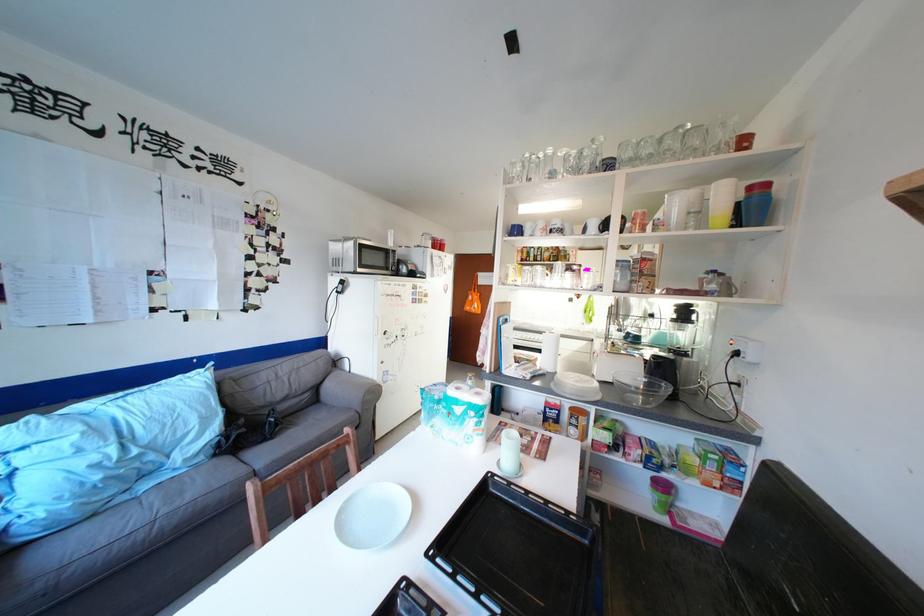
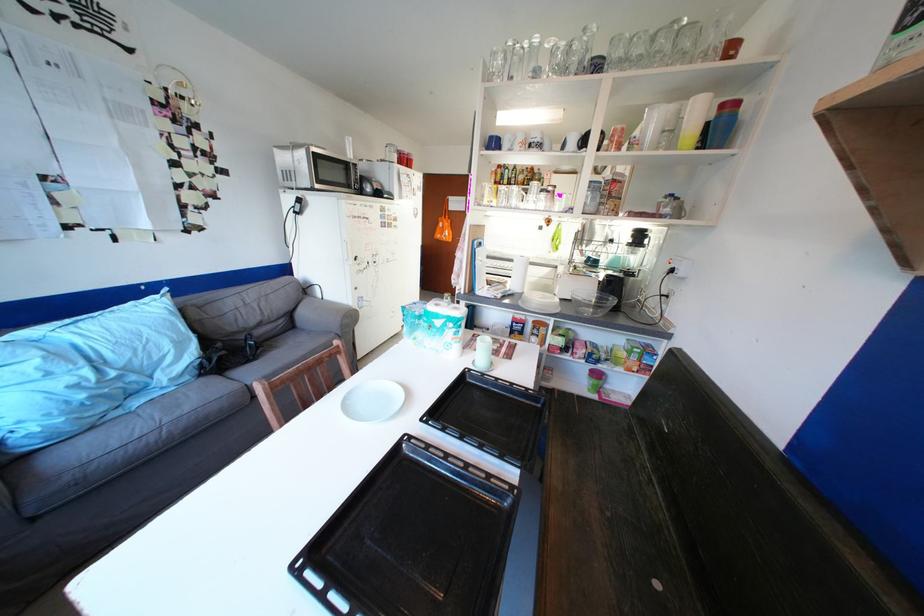
Where in the second image is the point corresponding to point 517,440 from the first image?

(492, 345)